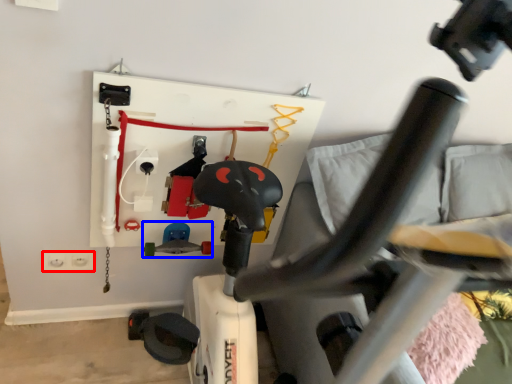
Question: Among these objects, which one is nearest to the camera, electric outlet (highlighted by a red box) or toy (highlighted by a blue box)?

Choices:
 (A) electric outlet
 (B) toy

Answer: (B)